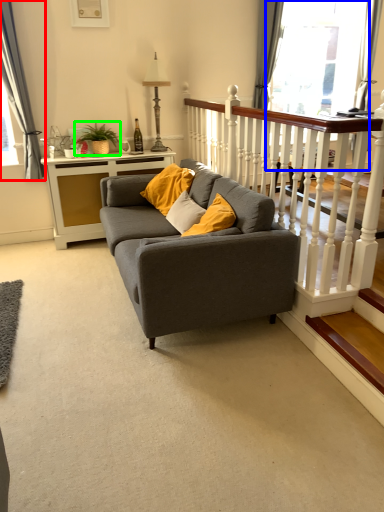
Question: Considering the real-world distances, which object is closest to curtain (highlighted by a red box)? glass door (highlighted by a blue box) or houseplant (highlighted by a green box).

Choices:
 (A) glass door
 (B) houseplant

Answer: (B)